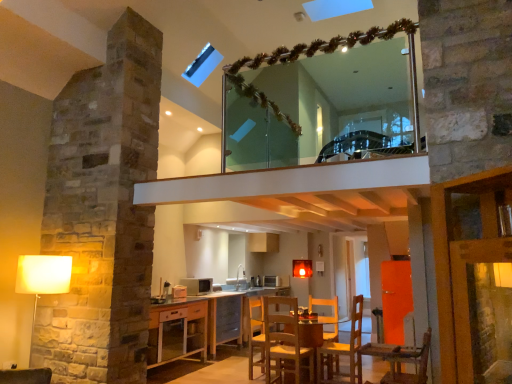
Question: Which direction should I rotate to look at metallic silver microwave at center, placed as the second appliance when sorted from top to bottom?

Choices:
 (A) right
 (B) left

Answer: (A)

Question: Is matte white lampshade at left at the right side of metallic silver microwave at center, the second appliance positioned from the front?

Choices:
 (A) yes
 (B) no

Answer: (B)

Question: Does matte white lampshade at left have a greater width compared to metallic silver microwave at center, acting as the 1th appliance starting from the right?

Choices:
 (A) no
 (B) yes

Answer: (B)

Question: Can you confirm if matte white lampshade at left is taller than metallic silver microwave at center, the second appliance viewed from the left?

Choices:
 (A) no
 (B) yes

Answer: (B)

Question: Is matte white lampshade at left oriented towards metallic silver microwave at center, which ranks as the 1th appliance in back-to-front order?

Choices:
 (A) no
 (B) yes

Answer: (A)

Question: From the image's perspective, is matte white lampshade at left beneath metallic silver microwave at center, placed as the second appliance when sorted from top to bottom?

Choices:
 (A) no
 (B) yes

Answer: (A)

Question: Is matte white lampshade at left directly adjacent to metallic silver microwave at center, the 1th appliance ordered from the bottom?

Choices:
 (A) yes
 (B) no

Answer: (B)

Question: Considering the relative positions of metallic silver microwave at center, which ranks as the 1th appliance in back-to-front order, and clear glass mirror at upper center in the image provided, is metallic silver microwave at center, which ranks as the 1th appliance in back-to-front order, behind clear glass mirror at upper center?

Choices:
 (A) yes
 (B) no

Answer: (A)

Question: Can you confirm if metallic silver microwave at center, the 1th appliance ordered from the bottom, is taller than clear glass mirror at upper center?

Choices:
 (A) no
 (B) yes

Answer: (A)

Question: Does metallic silver microwave at center, acting as the 1th appliance starting from the right, lie in front of clear glass mirror at upper center?

Choices:
 (A) yes
 (B) no

Answer: (B)

Question: Does metallic silver microwave at center, the 1th appliance ordered from the bottom, have a lesser width compared to clear glass mirror at upper center?

Choices:
 (A) yes
 (B) no

Answer: (B)

Question: Could you tell me if metallic silver microwave at center, the second appliance positioned from the front, is facing clear glass mirror at upper center?

Choices:
 (A) yes
 (B) no

Answer: (B)

Question: From a real-world perspective, is metallic silver microwave at center, placed as the second appliance when sorted from top to bottom, located higher than clear glass mirror at upper center?

Choices:
 (A) no
 (B) yes

Answer: (A)

Question: Does wooden glass table at center have a smaller size compared to matte silver microwave at center, which is the second appliance in back-to-front order?

Choices:
 (A) yes
 (B) no

Answer: (B)